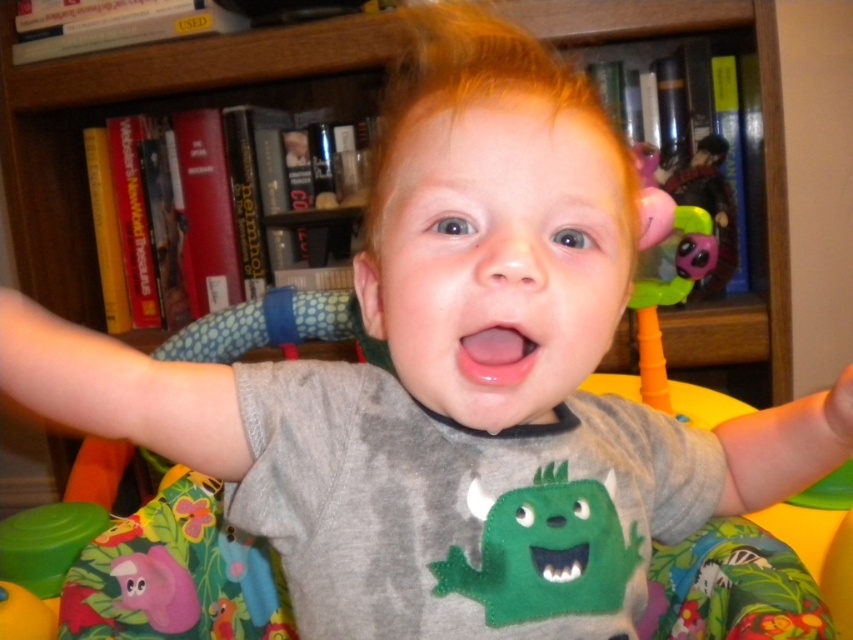
Does wooden bookshelf at upper center appear over green felt monster at center?

Yes, wooden bookshelf at upper center is above green felt monster at center.

Based on the photo, between wooden bookshelf at upper center and green felt monster at center, which one appears on the left side from the viewer's perspective?

wooden bookshelf at upper center is more to the left.

Who is more forward, (740,346) or (627,634)?

Point (627,634)

Where is `wooden bookshelf at upper center`? The height and width of the screenshot is (640, 853). wooden bookshelf at upper center is located at coordinates (149, 109).

Can you confirm if wooden bookshelf at upper center is smaller than translucent plastic toy at upper right?

Actually, wooden bookshelf at upper center might be larger than translucent plastic toy at upper right.

Does point (706, 12) come behind point (654, 387)?

Yes, point (706, 12) is behind point (654, 387).

Identify the location of wooden bookshelf at upper center. The width and height of the screenshot is (853, 640). pyautogui.click(x=149, y=109).

Does translucent plastic toy at upper right have a lesser width compared to pink glossy mouth at center?

No.

Is point (657, 390) closer to camera compared to point (479, 362)?

No, (657, 390) is behind (479, 362).

Is point (677, 294) farther from viewer compared to point (506, 385)?

Yes, it is.

At what (x,y) coordinates should I click in order to perform the action: click on translucent plastic toy at upper right. Please return your answer as a coordinate pair (x, y). The width and height of the screenshot is (853, 640). Looking at the image, I should click on (666, 282).